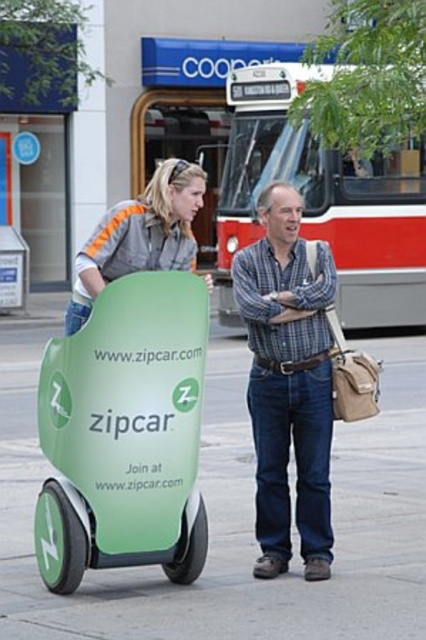
Question: Which point is closer to the camera taking this photo?

Choices:
 (A) (57, 550)
 (B) (167, 611)

Answer: (B)

Question: Among these points, which one is nearest to the camera?

Choices:
 (A) (169, 522)
 (B) (276, 632)
 (C) (259, 496)
 (D) (209, 276)

Answer: (B)

Question: In this image, where is green rubber hoverboard at center located relative to blue plaid shirt at center?

Choices:
 (A) above
 (B) below

Answer: (A)

Question: Does blue plaid shirt at center lie in front of gray fabric jacket at upper left?

Choices:
 (A) no
 (B) yes

Answer: (A)

Question: Which of the following is the farthest from the observer?

Choices:
 (A) green rubber hoverboard at center
 (B) blue plaid shirt at center
 (C) green matte zipcar at lower left

Answer: (B)

Question: Does green rubber hoverboard at center have a lesser width compared to gray fabric jacket at upper left?

Choices:
 (A) yes
 (B) no

Answer: (B)